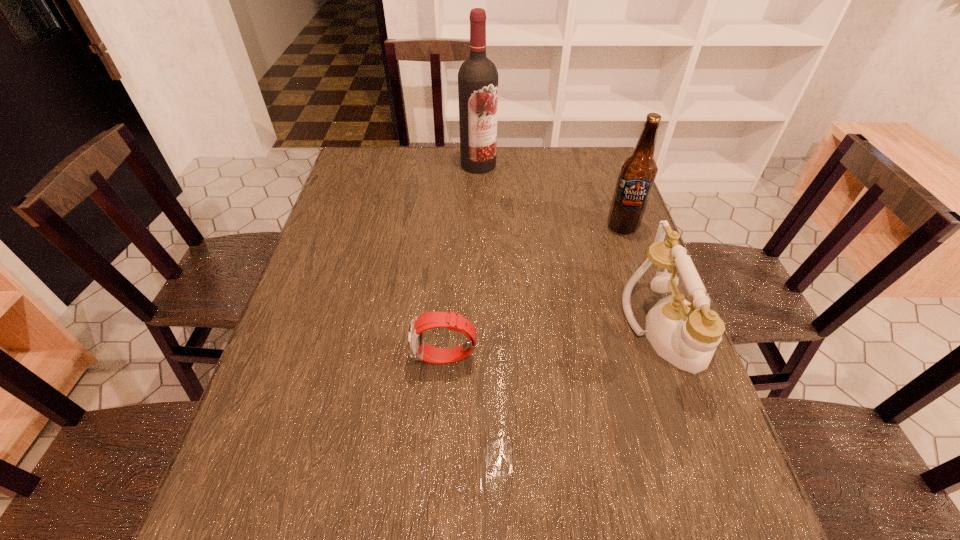
The height and width of the screenshot is (540, 960). I want to click on watch, so click(418, 350).

Where is `telephone`? This screenshot has height=540, width=960. telephone is located at coordinates (686, 335).

This screenshot has width=960, height=540. I want to click on the third shortest object, so click(637, 174).

Identify the location of beer bottle. The height and width of the screenshot is (540, 960). (637, 174).

The image size is (960, 540). Find the location of `the farthest object`. the farthest object is located at coordinates (478, 79).

You are a GUI agent. You are given a task and a screenshot of the screen. Output one action in this format:
    pyautogui.click(x=<x>, y=<y>)
    Task: Click on the tallest object
    
    Given the screenshot: What is the action you would take?
    pyautogui.click(x=478, y=79)

Where is `free space located on the face of the watch`? The height and width of the screenshot is (540, 960). free space located on the face of the watch is located at coordinates (383, 359).

Find the location of a particular element. The width and height of the screenshot is (960, 540). free point located 0.090m on the face of the watch is located at coordinates (373, 359).

Find the location of a particular element. The height and width of the screenshot is (540, 960). vacant space located on the face of the watch is located at coordinates click(x=279, y=359).

This screenshot has height=540, width=960. Find the location of `free spot located 0.320m on the label of the third shortest object`. free spot located 0.320m on the label of the third shortest object is located at coordinates 598,316.